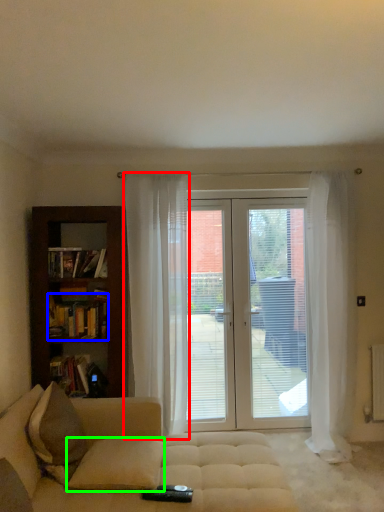
Question: Considering the real-world distances, which object is farthest from curtain (highlighted by a red box)? book (highlighted by a blue box) or pillow (highlighted by a green box)?

Choices:
 (A) book
 (B) pillow

Answer: (B)